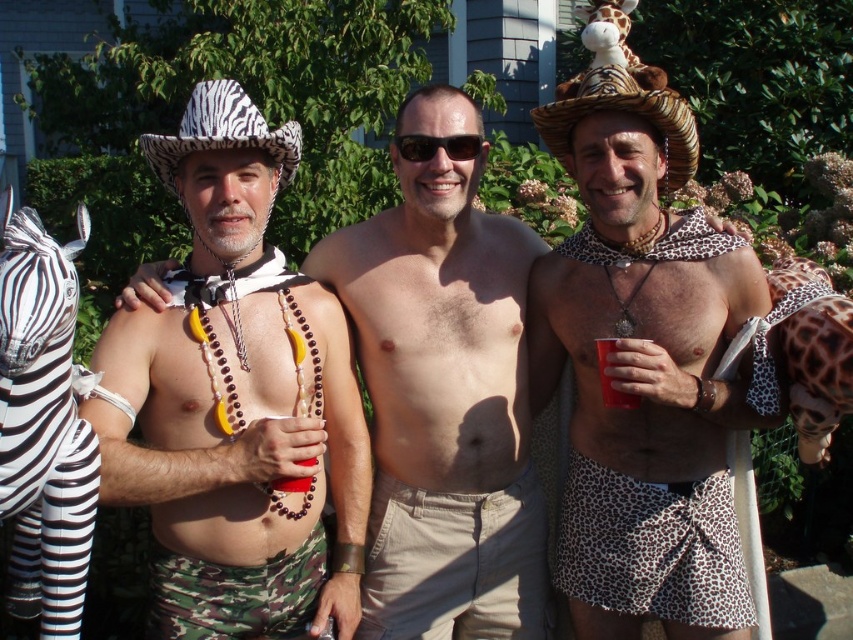
You are a photographer trying to capture the smooth skin torso at center and the red plastic cup at center in a single frame. Based on their positions, which object is closer to the camera?

The smooth skin torso at center is closer to the camera because the red plastic cup at center is positioned behind it.

You are standing in front of the black and white striped zebra at left. If you take a step forward, will you be closer to the zebra than 1.5 meters?

The black and white striped zebra at left is 1.79 meters away from viewer. If you take a step forward, you will be closer than 1.5 meters because 1.79 minus the step distance would likely be under 1.5 meters.